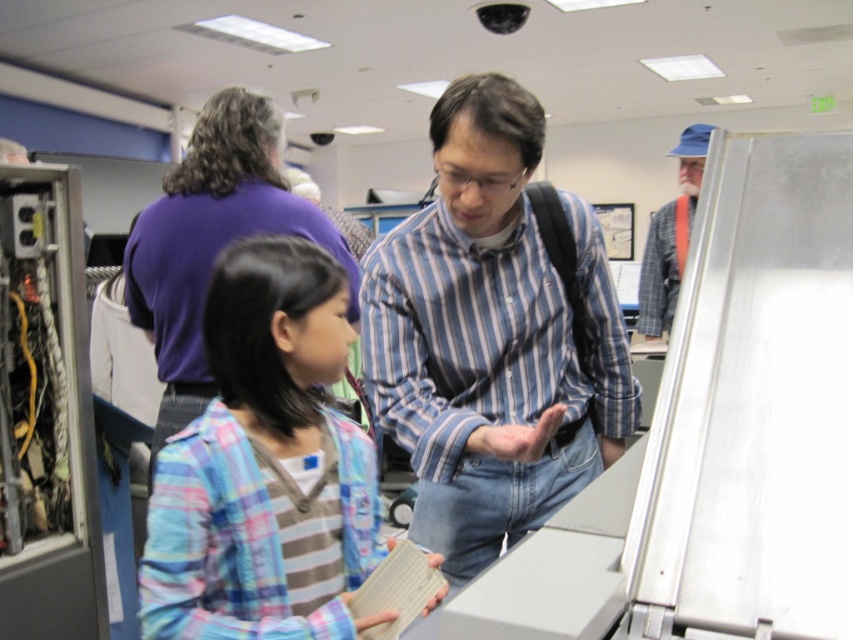
Looking at this image, you are a photographer trying to capture a closeup shot of the blue striped shirt at center and the plaid fabric shirt at center. Since you want to focus on both shirts equally, which shirt should you adjust the camera focus to accommodate the wider one?

The blue striped shirt at center is wider than the plaid fabric shirt at center, so you should adjust the camera focus to accommodate the blue striped shirt at center to ensure both are in focus.

You are a photographer trying to capture a clear image of both the blue striped shirt at center and the plaid fabric shirt at center. Since you want both shirts to be visible in the photo, which shirt should you focus on first to ensure the other remains in focus?

The blue striped shirt at center is larger than the plaid fabric shirt at center, so focusing on the larger blue striped shirt at center first would help keep the smaller plaid fabric shirt at center in focus as well.

Consider the image. What is the position of the blue striped shirt at center relative to the point marked at coordinates [491,337]?

The point marked at coordinates [491,337] is exactly where the blue striped shirt at center is located.